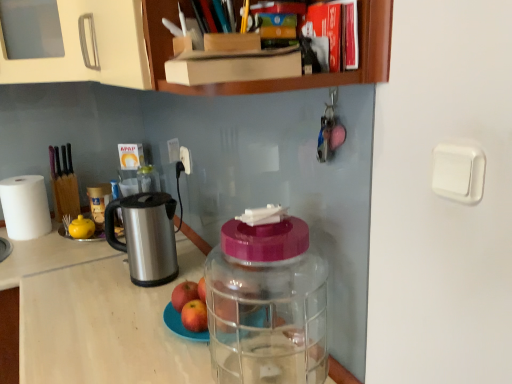
Measure the distance between transparent plastic bottle at center and camera.

29.01 inches.

The width and height of the screenshot is (512, 384). What do you see at coordinates (267, 301) in the screenshot?
I see `transparent plastic bottle at center` at bounding box center [267, 301].

Where is `beige wood cabinet at upper left`? beige wood cabinet at upper left is located at coordinates (262, 81).

The image size is (512, 384). Find the location of `stainless steel electric kettle at left`. stainless steel electric kettle at left is located at coordinates (146, 236).

Image resolution: width=512 pixels, height=384 pixels. Describe the element at coordinates (25, 207) in the screenshot. I see `white matte paper towel at left` at that location.

Identify the location of transparent plastic bottle at center. (267, 301).

From the image's perspective, does stainless steel electric kettle at left appear lower than transparent plastic container at center?

No, from the image's perspective, stainless steel electric kettle at left is not beneath transparent plastic container at center.

Is stainless steel electric kettle at left oriented towards transparent plastic container at center?

No, stainless steel electric kettle at left is not oriented towards transparent plastic container at center.

From a real-world perspective, is stainless steel electric kettle at left positioned over transparent plastic container at center based on gravity?

Yes, from a real-world perspective, stainless steel electric kettle at left is over transparent plastic container at center

Can we say stainless steel electric kettle at left lies outside transparent plastic container at center?

Yes, stainless steel electric kettle at left is not within transparent plastic container at center.

Can you confirm if white plastic power outlet at upper center is bigger than stainless steel electric kettle at left?

Actually, white plastic power outlet at upper center might be smaller than stainless steel electric kettle at left.

How many degrees apart are the facing directions of white plastic power outlet at upper center and stainless steel electric kettle at left?

There is a 38.6-degree angle between the facing directions of white plastic power outlet at upper center and stainless steel electric kettle at left.

Is white plastic power outlet at upper center thinner than stainless steel electric kettle at left?

Indeed, white plastic power outlet at upper center has a lesser width compared to stainless steel electric kettle at left.

From the image's perspective, relative to stainless steel electric kettle at left, is white plastic power outlet at upper center above or below?

white plastic power outlet at upper center is situated higher than stainless steel electric kettle at left in the image.

From a real-world perspective, is red matte apple at center, positioned as the 1th apple in front-to-back order, on beige wood cabinet at upper left?

No.

From the image's perspective, is red matte apple at center, the second apple from the back, below beige wood cabinet at upper left?

Yes, from the image's perspective, red matte apple at center, the second apple from the back, is beneath beige wood cabinet at upper left.

Does red matte apple at center, the second apple from the back, have a greater height compared to beige wood cabinet at upper left?

In fact, red matte apple at center, the second apple from the back, may be shorter than beige wood cabinet at upper left.

Which is more to the right, red matte apple at center, the second apple from the back, or beige wood cabinet at upper left?

red matte apple at center, the second apple from the back.

Is the position of white matte paper towel at left less distant than that of transparent plastic container at center?

That is False.

Would you say white matte paper towel at left is inside or outside transparent plastic container at center?

white matte paper towel at left is not enclosed by transparent plastic container at center.

In terms of width, does white matte paper towel at left look wider or thinner when compared to transparent plastic container at center?

white matte paper towel at left is thinner than transparent plastic container at center.

From a real-world perspective, is white matte paper towel at left positioned over transparent plastic container at center based on gravity?

Correct, in the physical world, white matte paper towel at left is higher than transparent plastic container at center.

Would you say transparent plastic bottle at center is outside red matte apple at center, the first apple viewed from the back?

Yes, transparent plastic bottle at center is outside of red matte apple at center, the first apple viewed from the back.

Measure the distance between transparent plastic bottle at center and red matte apple at center, which is the second apple in front-to-back order.

transparent plastic bottle at center and red matte apple at center, which is the second apple in front-to-back order, are 8.68 inches apart from each other.

Find the location of `the 1st apple below the transparent plastic bottle at center (from the image's perspective)`. the 1st apple below the transparent plastic bottle at center (from the image's perspective) is located at coordinates (184, 294).

From a real-world perspective, is transparent plastic bottle at center located higher than red matte apple at center, which is the second apple in front-to-back order?

Correct, in the physical world, transparent plastic bottle at center is higher than red matte apple at center, which is the second apple in front-to-back order.

In the scene shown: Is transparent plastic container at center located within red matte apple at center, the first apple viewed from the back?

Actually, transparent plastic container at center is outside red matte apple at center, the first apple viewed from the back.

Is red matte apple at center, the first apple viewed from the back, wider than transparent plastic container at center?

Incorrect, the width of red matte apple at center, the first apple viewed from the back, does not surpass that of transparent plastic container at center.

Does point (192, 299) appear closer or farther from the camera than point (189, 232)?

Clearly, point (192, 299) is closer to the camera than point (189, 232).

Is red matte apple at center, which is the second apple in front-to-back order, turned away from transparent plastic container at center?

No, transparent plastic container at center is not at the back of red matte apple at center, which is the second apple in front-to-back order.

Would you say red matte apple at center, which is the second apple in front-to-back order, contains white plastic power outlet at upper center?

No, red matte apple at center, which is the second apple in front-to-back order, does not contain white plastic power outlet at upper center.

Find the location of a particular element. power outlet that appears above the red matte apple at center, which is the second apple in front-to-back order (from the image's perspective) is located at coordinates (185, 159).

From a real-world perspective, between red matte apple at center, which is the second apple in front-to-back order, and white plastic power outlet at upper center, who is vertically lower?

red matte apple at center, which is the second apple in front-to-back order.

Locate an element on the screen. Image resolution: width=512 pixels, height=384 pixels. appliance lying behind the transparent plastic container at center is located at coordinates (146, 236).

You are a GUI agent. You are given a task and a screenshot of the screen. Output one action in this format:
    pyautogui.click(x=<x>, y=<y>)
    Task: Click on the appliance located below the white plastic power outlet at upper center (from the image's perspective)
    This screenshot has width=512, height=384.
    Given the screenshot: What is the action you would take?
    pyautogui.click(x=146, y=236)

Based on their spatial positions, is transparent plastic bottle at center or white matte paper towel at left further from red matte apple at center, which is the second apple in front-to-back order?

The object further to red matte apple at center, which is the second apple in front-to-back order, is white matte paper towel at left.

Which object lies nearer to the anchor point transparent plastic bottle at center, red matte apple at center, the first apple viewed from the back, or red matte apple at center, positioned as the 1th apple in front-to-back order?

Based on the image, red matte apple at center, positioned as the 1th apple in front-to-back order, appears to be nearer to transparent plastic bottle at center.

From the image, which object appears to be nearer to white matte paper towel at left, stainless steel electric kettle at left or transparent plastic container at center?

transparent plastic container at center is positioned closer to the anchor white matte paper towel at left.

Looking at the image, which one is located closer to white matte paper towel at left, transparent plastic bottle at center or beige wood cabinet at upper left?

Among the two, beige wood cabinet at upper left is located nearer to white matte paper towel at left.

Based on their spatial positions, is transparent plastic container at center or beige wood cabinet at upper left closer to red matte apple at center, positioned as the 1th apple in front-to-back order?

transparent plastic container at center lies closer to red matte apple at center, positioned as the 1th apple in front-to-back order, than the other object.

Based on their spatial positions, is transparent plastic bottle at center or red matte apple at center, the first apple viewed from the back, closer to transparent plastic container at center?

Based on the image, red matte apple at center, the first apple viewed from the back, appears to be nearer to transparent plastic container at center.

Looking at the image, which one is located closer to red matte apple at center, the first apple viewed from the back, beige wood cabinet at upper left or red matte apple at center, positioned as the 1th apple in front-to-back order?

The object closer to red matte apple at center, the first apple viewed from the back, is red matte apple at center, positioned as the 1th apple in front-to-back order.

From the image, which object appears to be farther from red matte apple at center, the second apple from the back, beige wood cabinet at upper left or transparent plastic bottle at center?

beige wood cabinet at upper left is further to red matte apple at center, the second apple from the back.

This screenshot has height=384, width=512. What are the coordinates of `desk positioned between transparent plastic bottle at center and white plastic power outlet at upper center from near to far` in the screenshot? It's located at (9, 335).

Locate an element on the screen. This screenshot has height=384, width=512. bottle between beige wood cabinet at upper left and red matte apple at center, the first apple viewed from the back, in the up-down direction is located at coordinates 267,301.

The image size is (512, 384). I want to click on appliance positioned between transparent plastic container at center and white plastic power outlet at upper center from near to far, so click(146, 236).

This screenshot has height=384, width=512. Find the location of `apple between red matte apple at center, which is the second apple in front-to-back order, and transparent plastic container at center in the up-down direction`. apple between red matte apple at center, which is the second apple in front-to-back order, and transparent plastic container at center in the up-down direction is located at coordinates (194, 316).